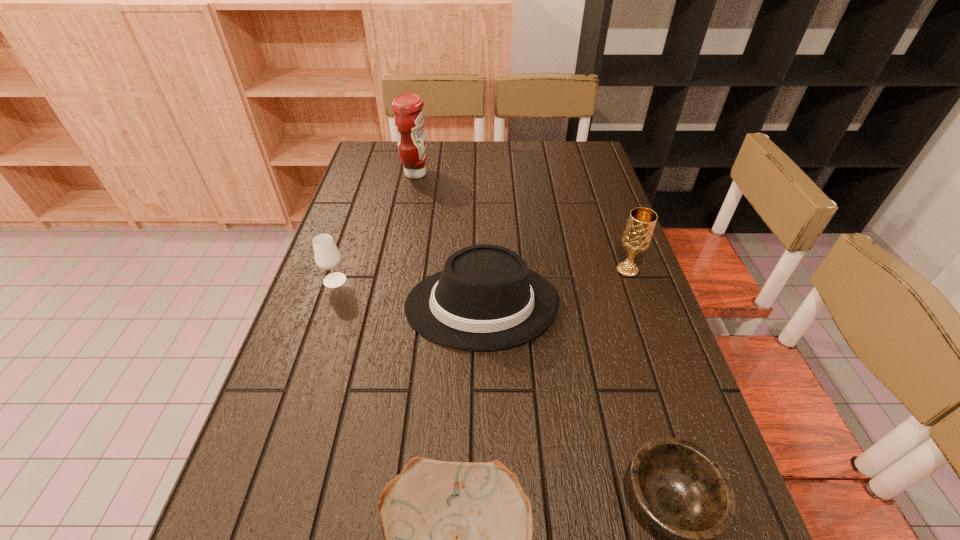
I want to click on free space at the far right corner, so click(x=562, y=144).

The height and width of the screenshot is (540, 960). Find the location of `free spot between the chalice and the farthest object`. free spot between the chalice and the farthest object is located at coordinates (521, 221).

Where is `object identified as the second closest to the second shortest object`? object identified as the second closest to the second shortest object is located at coordinates (486, 298).

At what (x,y) coordinates should I click in order to perform the action: click on object that is the third closest one to the second tallest object. Please return your answer as a coordinate pair (x, y). Looking at the image, I should click on (458, 535).

Find the location of a particular element. free spot that satisfies the following two spatial constraints: 1. on the back side of the tallest object; 2. on the left side of the glass is located at coordinates (371, 173).